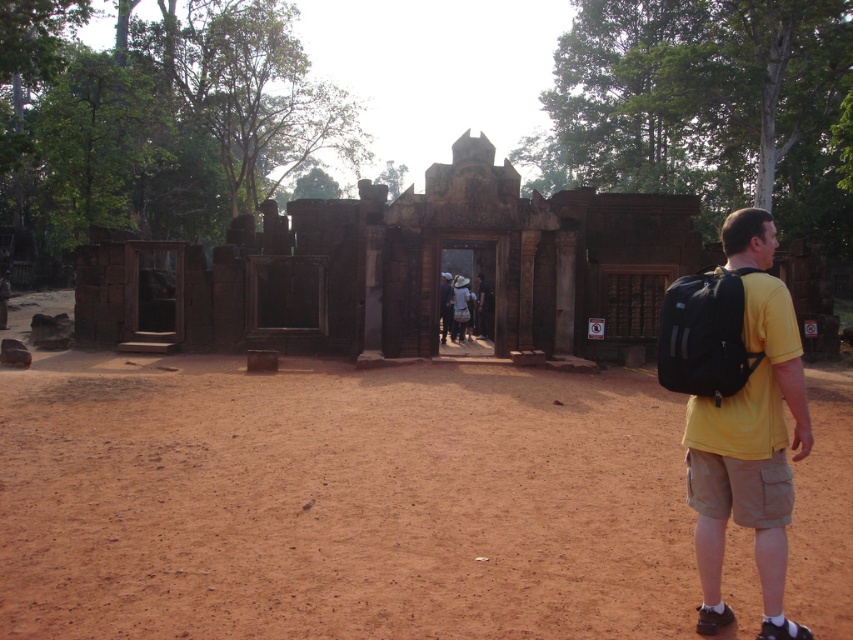
Can you confirm if black fabric backpack at right is smaller than yellow t-shirt at center?

Yes.

Which of these two, black fabric backpack at right or yellow t-shirt at center, stands taller?

yellow t-shirt at center is taller.

Which is behind, point (718, 291) or point (447, 288)?

Positioned behind is point (447, 288).

Where is `black fabric backpack at right`? This screenshot has width=853, height=640. black fabric backpack at right is located at coordinates (704, 333).

Which is below, yellow cotton shirt at right or black fabric backpack at right?

Positioned lower is yellow cotton shirt at right.

Can you confirm if yellow cotton shirt at right is bigger than black fabric backpack at right?

Result: Indeed, yellow cotton shirt at right has a larger size compared to black fabric backpack at right.

Is point (773, 528) positioned behind point (706, 292)?

No, it is not.

At what (x,y) coordinates should I click in order to perform the action: click on yellow cotton shirt at right. Please return your answer as a coordinate pair (x, y). This screenshot has width=853, height=640. Looking at the image, I should click on (749, 436).

Identify the location of brown stone ruins at center. This screenshot has height=640, width=853. (407, 268).

Based on the photo, between brown stone ruins at center and black fabric backpack at right, which one is positioned lower?

Positioned lower is black fabric backpack at right.

What do you see at coordinates (407, 268) in the screenshot? I see `brown stone ruins at center` at bounding box center [407, 268].

Identify the location of brown stone ruins at center. 407,268.